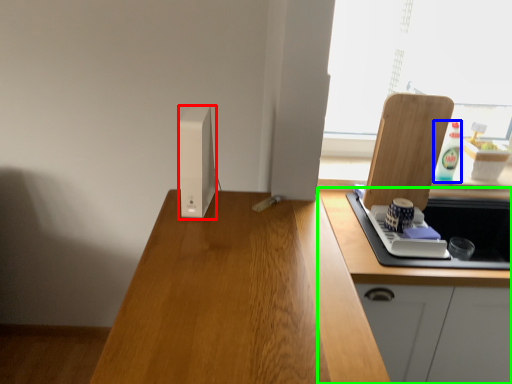
Question: Which object is the farthest from appliance (highlighted by a red box)? Choose among these: bottle (highlighted by a blue box) or cabinetry (highlighted by a green box).

Choices:
 (A) bottle
 (B) cabinetry

Answer: (A)